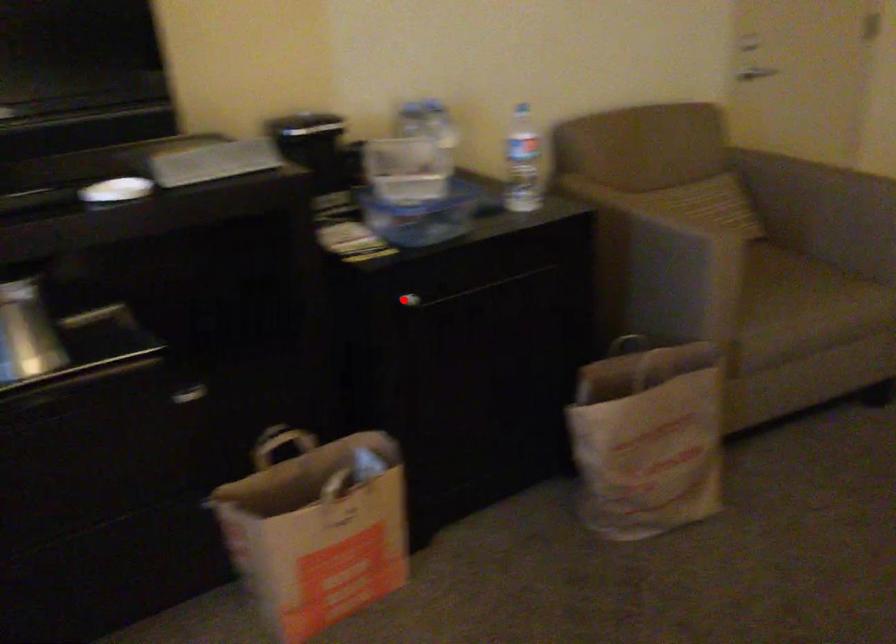
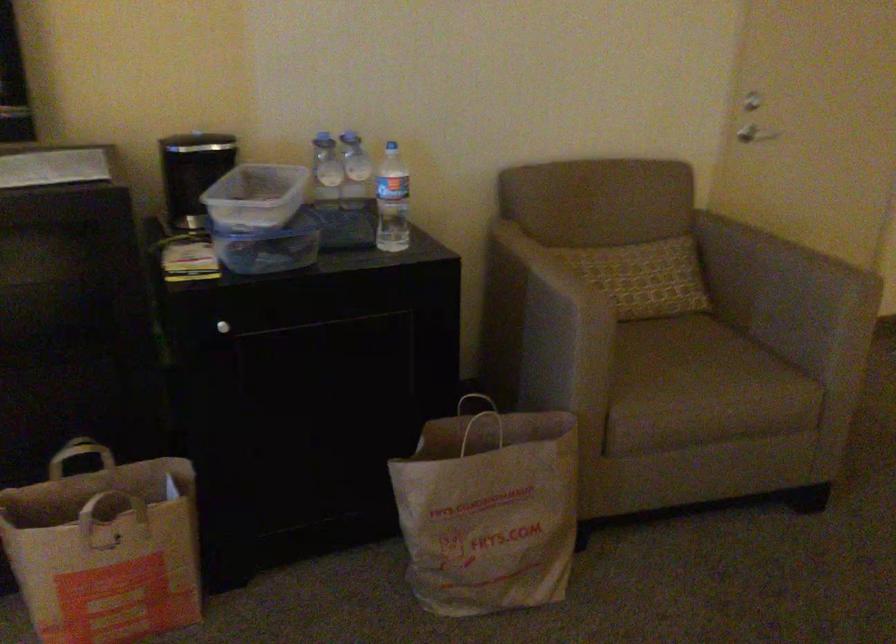
The point at the highlighted location is marked in the first image. Where is the corresponding point in the second image?

(222, 327)